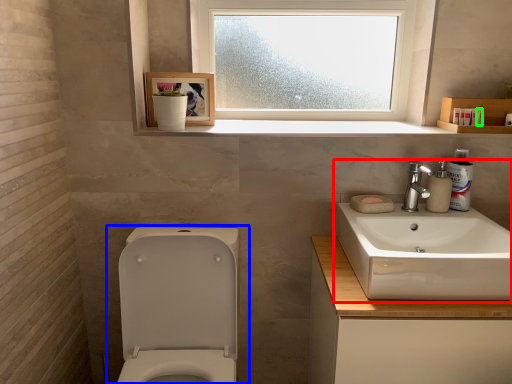
Question: Which object is the farthest from sink (highlighted by a red box)? Choose among these: toilet (highlighted by a blue box) or toiletry (highlighted by a green box).

Choices:
 (A) toilet
 (B) toiletry

Answer: (A)